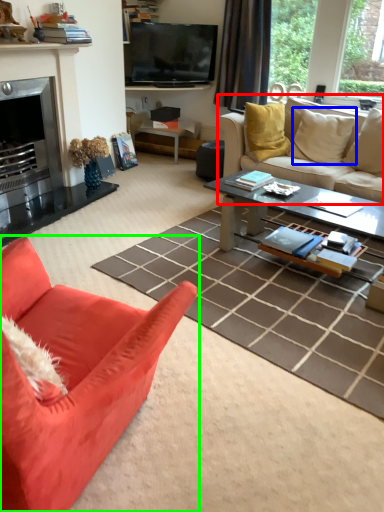
Question: Estimate the real-world distances between objects in this image. Which object is farther from studio couch (highlighted by a red box), pillow (highlighted by a blue box) or studio couch (highlighted by a green box)?

Choices:
 (A) pillow
 (B) studio couch

Answer: (B)